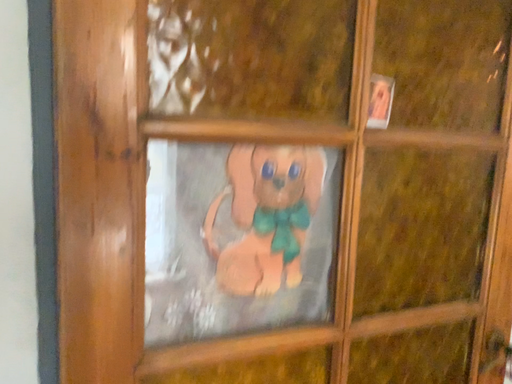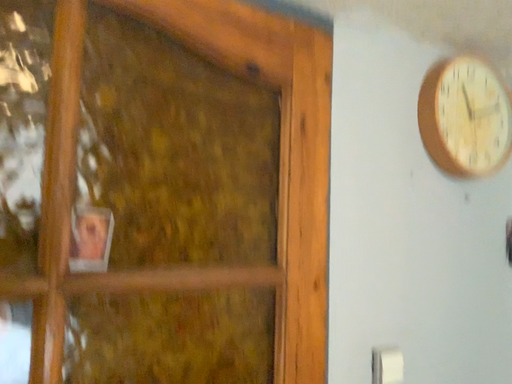
Question: Which way did the camera rotate in the video?

Choices:
 (A) rotated right
 (B) rotated left

Answer: (A)